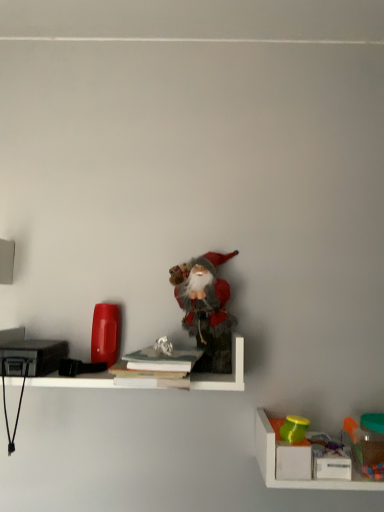
At what (x,y) coordinates should I click in order to perform the action: click on blank space situated above white paper at center, the 1th book positioned from the top (from a real-world perspective). Please return your answer as a coordinate pair (x, y). Looking at the image, I should click on (162, 357).